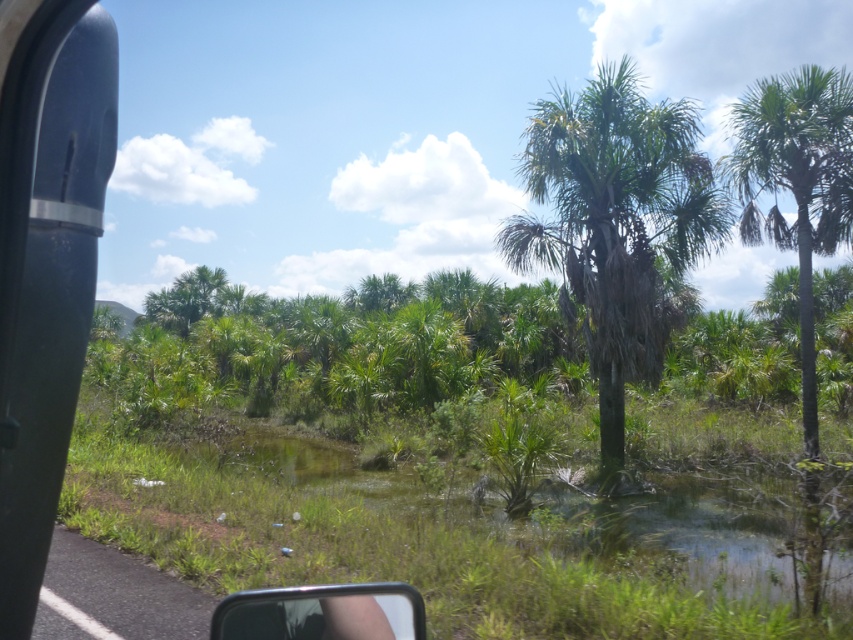
Based on the photo, is green leafy palm tree at center taller than clear plastic view mirror at lower center?

Correct, green leafy palm tree at center is much taller as clear plastic view mirror at lower center.

Is green leafy palm tree at center thinner than clear plastic view mirror at lower center?

No, green leafy palm tree at center is not thinner than clear plastic view mirror at lower center.

Is point (608, 323) positioned behind point (386, 627)?

Yes, point (608, 323) is behind point (386, 627).

This screenshot has height=640, width=853. What are the coordinates of `green leafy palm tree at center` in the screenshot? It's located at (614, 224).

In the scene shown: Which of these two, green leafy palm tree at center or green leafy palm tree at right, stands shorter?

green leafy palm tree at center

Who is positioned more to the right, green leafy palm tree at center or green leafy palm tree at right?

From the viewer's perspective, green leafy palm tree at right appears more on the right side.

Which is in front, point (618, 280) or point (846, 230)?

Point (618, 280) is more forward.

The image size is (853, 640). I want to click on green leafy palm tree at center, so click(x=614, y=224).

Is point (750, 221) more distant than point (422, 632)?

Yes, point (750, 221) is farther from viewer.

Locate an element on the screen. Image resolution: width=853 pixels, height=640 pixels. green leafy palm tree at right is located at coordinates (796, 184).